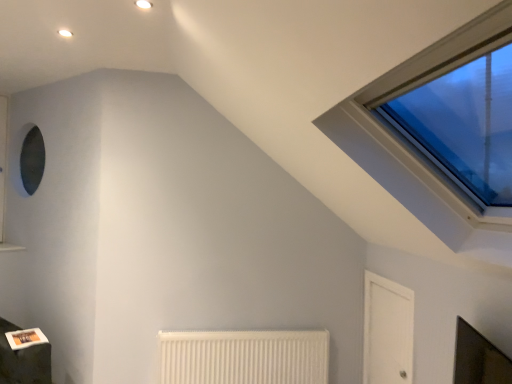
Where is `white glossy door at lower right`? This screenshot has width=512, height=384. white glossy door at lower right is located at coordinates (387, 331).

This screenshot has height=384, width=512. What do you see at coordinates (387, 331) in the screenshot? I see `white glossy door at lower right` at bounding box center [387, 331].

Locate an element on the screen. This screenshot has height=384, width=512. white ribbed radiator at lower center is located at coordinates (243, 357).

In order to face white ribbed radiator at lower center, should I rotate leftwards or rightwards?

Turn left by 1.169 degrees to look at white ribbed radiator at lower center.

This screenshot has width=512, height=384. Describe the element at coordinates (243, 357) in the screenshot. I see `white ribbed radiator at lower center` at that location.

The image size is (512, 384). In order to click on white glossy door at lower right in this screenshot , I will do `click(387, 331)`.

From the picture: Considering the positions of objects white ribbed radiator at lower center and white glossy door at lower right in the image provided, who is more to the right, white ribbed radiator at lower center or white glossy door at lower right?

white glossy door at lower right is more to the right.

Is white ribbed radiator at lower center in front of or behind white glossy door at lower right in the image?

In the image, white ribbed radiator at lower center appears behind white glossy door at lower right.

Is point (245, 343) farther from camera compared to point (366, 376)?

No.

From the image's perspective, is white ribbed radiator at lower center on white glossy door at lower right?

No.

From a real-world perspective, which object stands above the other?

From a 3D spatial view, white glossy door at lower right is above.

Does white ribbed radiator at lower center have a greater width compared to white glossy door at lower right?

Correct, the width of white ribbed radiator at lower center exceeds that of white glossy door at lower right.

Between white ribbed radiator at lower center and white glossy door at lower right, which one has more height?

With more height is white glossy door at lower right.

Between white ribbed radiator at lower center and white glossy door at lower right, which one has larger size?

white ribbed radiator at lower center is bigger.

Choose the correct answer: Is white ribbed radiator at lower center inside white glossy door at lower right or outside it?

white ribbed radiator at lower center is outside white glossy door at lower right.

Is white ribbed radiator at lower center in contact with white glossy door at lower right?

No, white ribbed radiator at lower center is not next to white glossy door at lower right.

Is white glossy door at lower right at the back of white ribbed radiator at lower center?

That's not correct — white ribbed radiator at lower center is not looking away from white glossy door at lower right.

Measure the distance between white ribbed radiator at lower center and white glossy door at lower right.

white ribbed radiator at lower center and white glossy door at lower right are 27.49 inches apart.

This screenshot has width=512, height=384. Identify the location of radiator directly beneath the white glossy door at lower right (from a real-world perspective). (x=243, y=357).

Between white glossy door at lower right and white ribbed radiator at lower center, which one appears on the right side from the viewer's perspective?

Positioned to the right is white glossy door at lower right.

Is the depth of white glossy door at lower right greater than that of white ribbed radiator at lower center?

No, it is in front of white ribbed radiator at lower center.

Considering the points (372, 377) and (210, 383), which point is in front, point (372, 377) or point (210, 383)?

Positioned in front is point (210, 383).

From the image's perspective, is white glossy door at lower right on top of white ribbed radiator at lower center?

Correct, white glossy door at lower right appears higher than white ribbed radiator at lower center in the image.

From a real-world perspective, is white glossy door at lower right above or below white ribbed radiator at lower center?

Clearly, from a real-world perspective, white glossy door at lower right is above white ribbed radiator at lower center.

Looking at their sizes, would you say white glossy door at lower right is wider or thinner than white ribbed radiator at lower center?

Considering their sizes, white glossy door at lower right looks slimmer than white ribbed radiator at lower center.

Does white glossy door at lower right have a lesser height compared to white ribbed radiator at lower center?

In fact, white glossy door at lower right may be taller than white ribbed radiator at lower center.

Can you confirm if white glossy door at lower right is bigger than white ribbed radiator at lower center?

No.

Is white glossy door at lower right outside of white ribbed radiator at lower center?

white glossy door at lower right is positioned outside white ribbed radiator at lower center.

Is white glossy door at lower right beside white ribbed radiator at lower center?

They are not placed beside each other.

Is white glossy door at lower right turned away from white ribbed radiator at lower center?

No, white ribbed radiator at lower center is not at the back of white glossy door at lower right.

The image size is (512, 384). Identify the location of radiator below the white glossy door at lower right (from the image's perspective). (243, 357).

The width and height of the screenshot is (512, 384). Find the location of `glass door that is above the white ribbed radiator at lower center (from the image's perspective)`. glass door that is above the white ribbed radiator at lower center (from the image's perspective) is located at coordinates (387, 331).

This screenshot has width=512, height=384. Find the location of `glass door on the right of white ribbed radiator at lower center`. glass door on the right of white ribbed radiator at lower center is located at coordinates coord(387,331).